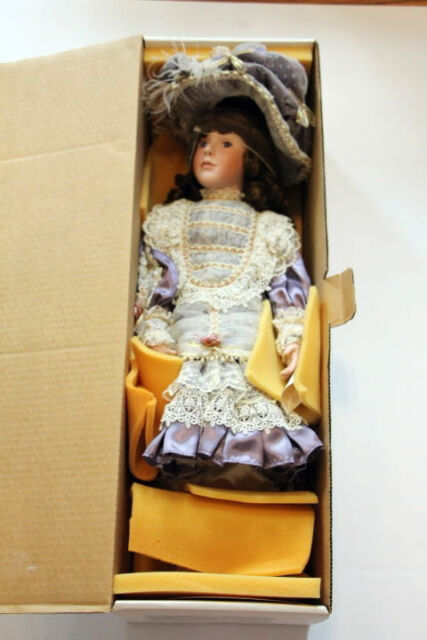
Where is `foam`? The height and width of the screenshot is (640, 427). foam is located at coordinates (196, 532).